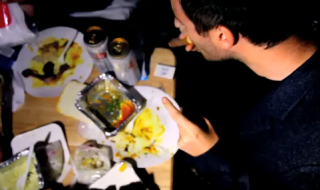
This screenshot has width=320, height=190. I want to click on aluminum tray, so click(x=137, y=105).